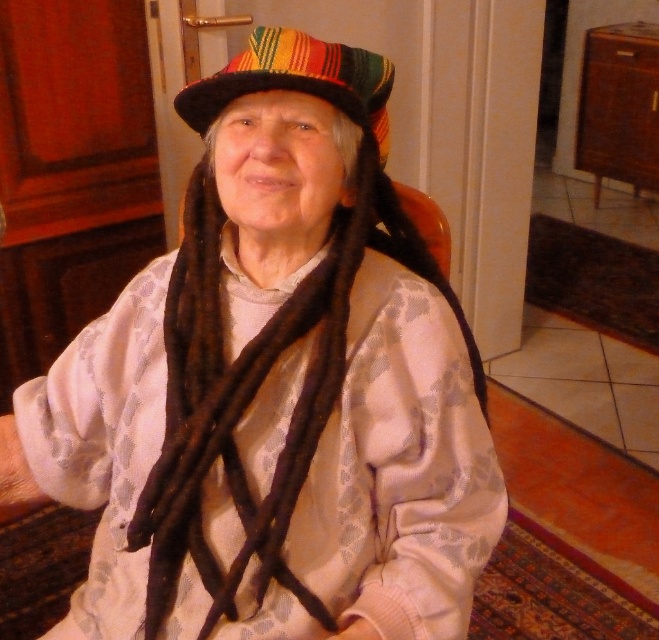
Question: Where is multicolored fabric hat at upper center located in relation to striped fabric hat at upper center in the image?

Choices:
 (A) above
 (B) below

Answer: (B)

Question: Does multicolored fabric hat at upper center have a larger size compared to striped fabric hat at upper center?

Choices:
 (A) no
 (B) yes

Answer: (B)

Question: Which point is closer to the camera?

Choices:
 (A) multicolored fabric hat at upper center
 (B) striped fabric hat at upper center

Answer: (B)

Question: Which point is farther to the camera?

Choices:
 (A) (360, 113)
 (B) (159, 560)

Answer: (B)

Question: Does multicolored fabric hat at upper center have a larger size compared to striped fabric hat at upper center?

Choices:
 (A) no
 (B) yes

Answer: (B)

Question: Which point is closer to the camera taking this photo?

Choices:
 (A) (181, 93)
 (B) (241, 232)

Answer: (A)